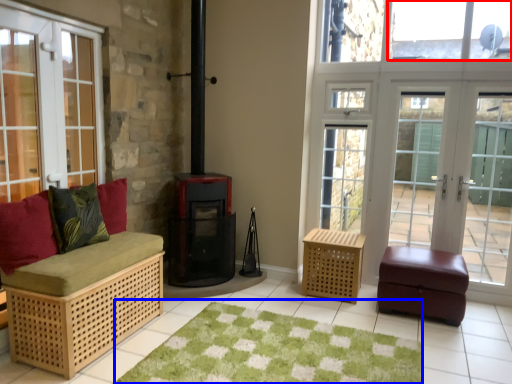
Question: Which of the following is the farthest to the observer, window screen (highlighted by a red box) or mat (highlighted by a blue box)?

Choices:
 (A) window screen
 (B) mat

Answer: (A)